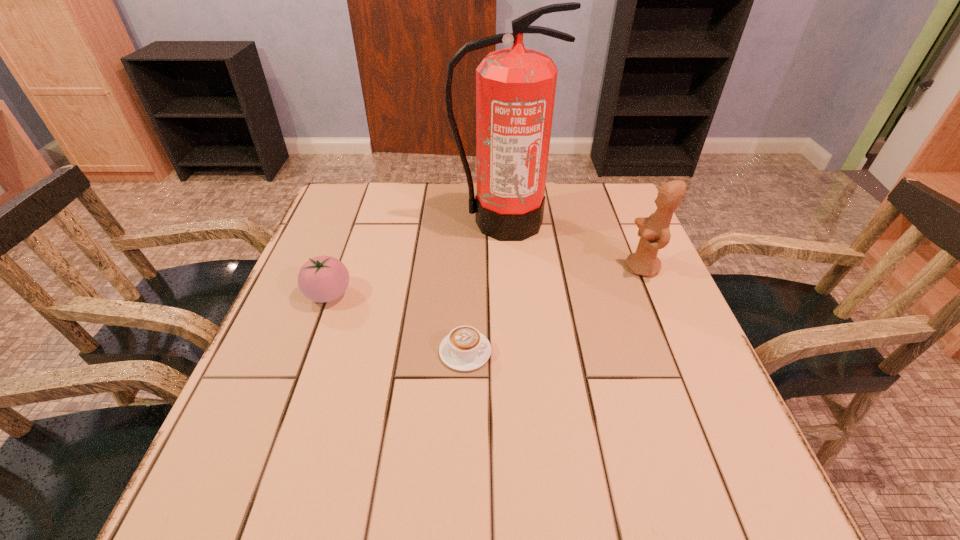
This screenshot has width=960, height=540. In order to click on vacant space that's between the leftmost object and the rightmost object in this screenshot , I will do `click(486, 281)`.

Image resolution: width=960 pixels, height=540 pixels. What are the coordinates of `free space that is in between the tallest object and the third shortest object` in the screenshot? It's located at (572, 245).

Find the location of a particular element. Image resolution: width=960 pixels, height=540 pixels. empty space between the shortest object and the farthest object is located at coordinates (484, 287).

Locate an element on the screen. The image size is (960, 540). object that ranks as the closest to the figurine is located at coordinates (515, 87).

Where is `object that can be found as the closest to the nearest object`? The image size is (960, 540). object that can be found as the closest to the nearest object is located at coordinates (321, 279).

At what (x,y) coordinates should I click in order to perform the action: click on free spot that satisfies the following two spatial constraints: 1. on the front side of the farthest object; 2. with the handle on the right side of the nearest object. Please return your answer as a coordinate pair (x, y). The width and height of the screenshot is (960, 540). Looking at the image, I should click on (511, 352).